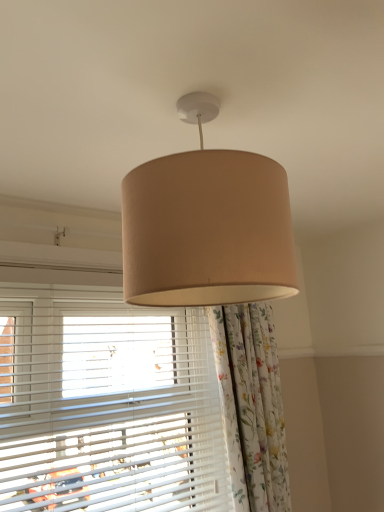
Question: Is beige fabric lampshade at center far from white matte blinds at lower left?

Choices:
 (A) yes
 (B) no

Answer: (B)

Question: Is beige fabric lampshade at center to the left of white matte blinds at lower left from the viewer's perspective?

Choices:
 (A) yes
 (B) no

Answer: (B)

Question: Considering the relative sizes of beige fabric lampshade at center and white matte blinds at lower left in the image provided, is beige fabric lampshade at center thinner than white matte blinds at lower left?

Choices:
 (A) yes
 (B) no

Answer: (B)

Question: Considering the relative positions of beige fabric lampshade at center and white matte blinds at lower left in the image provided, is beige fabric lampshade at center to the right of white matte blinds at lower left from the viewer's perspective?

Choices:
 (A) no
 (B) yes

Answer: (B)

Question: From the image's perspective, is beige fabric lampshade at center on top of white matte blinds at lower left?

Choices:
 (A) no
 (B) yes

Answer: (B)

Question: Does beige fabric lampshade at center have a smaller size compared to white matte blinds at lower left?

Choices:
 (A) yes
 (B) no

Answer: (A)

Question: From a real-world perspective, is white matte blinds at lower left beneath beige fabric lampshade at center?

Choices:
 (A) no
 (B) yes

Answer: (B)

Question: Is beige fabric lampshade at center surrounded by white matte blinds at lower left?

Choices:
 (A) no
 (B) yes

Answer: (A)

Question: Is white matte blinds at lower left placed right next to beige fabric lampshade at center?

Choices:
 (A) yes
 (B) no

Answer: (B)

Question: From a real-world perspective, is white matte blinds at lower left located higher than beige fabric lampshade at center?

Choices:
 (A) yes
 (B) no

Answer: (B)

Question: Does white matte blinds at lower left have a greater height compared to beige fabric lampshade at center?

Choices:
 (A) no
 (B) yes

Answer: (B)

Question: Is white matte blinds at lower left positioned with its back to beige fabric lampshade at center?

Choices:
 (A) no
 (B) yes

Answer: (A)

Question: Is beige fabric lampshade at center bigger or smaller than white matte blinds at lower left?

Choices:
 (A) small
 (B) big

Answer: (A)